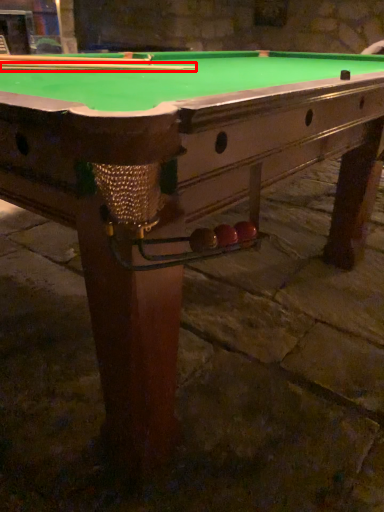
Question: Observing the image, what is the correct spatial positioning of cue (annotated by the red box) in reference to cue?

Choices:
 (A) right
 (B) left

Answer: (A)